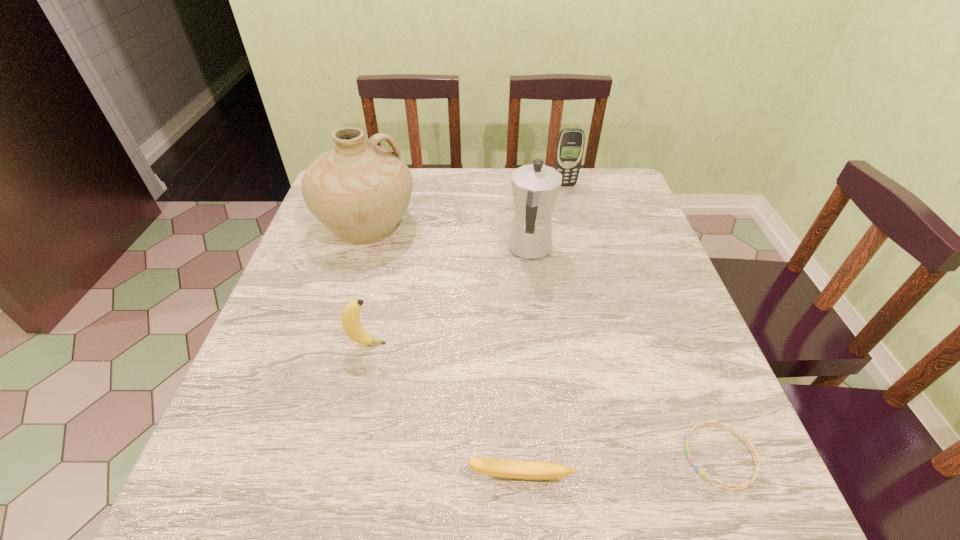
Image resolution: width=960 pixels, height=540 pixels. Find the location of `free region located on the right of the pottery`. free region located on the right of the pottery is located at coordinates (480, 224).

Locate an element on the screen. The width and height of the screenshot is (960, 540). vacant space located 0.130m on the left of the coffeepot is located at coordinates pyautogui.click(x=456, y=249).

Identify the location of free space located 0.220m on the screen of the fifth object from left to right. (576, 232).

This screenshot has height=540, width=960. Identify the location of vacant space located 0.150m from the stem of the third shortest object. (459, 344).

At what (x,y) coordinates should I click in order to perform the action: click on blank space located on the surface of the bracelet showing star-shaped elements. Please return your answer as a coordinate pair (x, y). Image resolution: width=960 pixels, height=540 pixels. Looking at the image, I should click on (650, 456).

Identify the location of blank area located 0.350m on the surface of the bracelet showing star-shaped elements. The image size is (960, 540). (476, 456).

The image size is (960, 540). I want to click on vacant point located 0.330m on the surface of the bracelet showing star-shaped elements, so click(489, 456).

Locate an element on the screen. pottery located at the far edge is located at coordinates (359, 191).

Locate an element on the screen. This screenshot has width=960, height=540. cellular telephone that is at the far edge is located at coordinates (570, 145).

You are a GUI agent. You are given a task and a screenshot of the screen. Output one action in this format:
    pyautogui.click(x=<x>, y=<y>)
    Task: Click on the banana located in the near edge section of the desktop
    
    Given the screenshot: What is the action you would take?
    pyautogui.click(x=517, y=469)